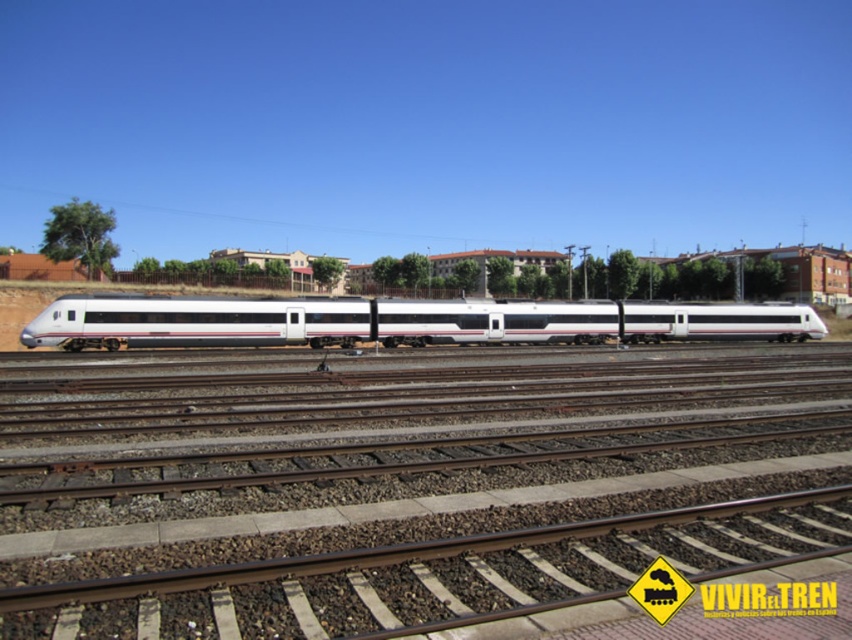
Question: From the image, what is the correct spatial relationship of brown gravel at center in relation to white glossy train at center?

Choices:
 (A) left
 (B) right

Answer: (A)

Question: Among these points, which one is farthest from the camera?

Choices:
 (A) (586, 317)
 (B) (182, 520)

Answer: (A)

Question: Among these points, which one is nearest to the camera?

Choices:
 (A) (573, 579)
 (B) (787, 312)

Answer: (A)

Question: Is brown gravel at center below white glossy train at center?

Choices:
 (A) yes
 (B) no

Answer: (A)

Question: Which point is closer to the camera?

Choices:
 (A) (118, 561)
 (B) (79, 337)

Answer: (A)

Question: Does brown gravel at center lie in front of white glossy train at center?

Choices:
 (A) yes
 (B) no

Answer: (A)